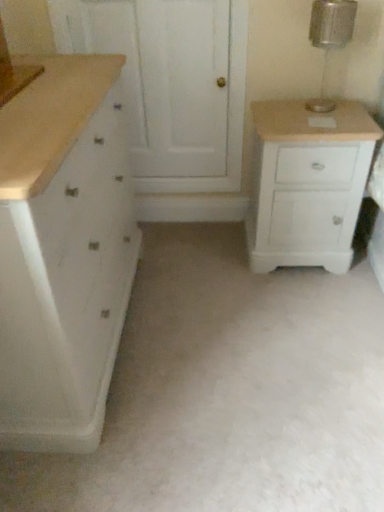
Question: Can you confirm if metallic glass lamp at upper right is positioned to the left of white matte chest of drawers at left, the 2th chest of drawers when ordered from right to left?

Choices:
 (A) no
 (B) yes

Answer: (A)

Question: Are metallic glass lamp at upper right and white matte chest of drawers at left, which is the first chest of drawers from left to right, far apart?

Choices:
 (A) no
 (B) yes

Answer: (B)

Question: From a real-world perspective, is metallic glass lamp at upper right beneath white matte chest of drawers at left, the 2th chest of drawers when ordered from right to left?

Choices:
 (A) yes
 (B) no

Answer: (B)

Question: Is metallic glass lamp at upper right turned away from white matte chest of drawers at left, which is the first chest of drawers from left to right?

Choices:
 (A) no
 (B) yes

Answer: (A)

Question: Can you confirm if metallic glass lamp at upper right is shorter than white matte chest of drawers at left, which is the first chest of drawers from left to right?

Choices:
 (A) no
 (B) yes

Answer: (B)

Question: Is metallic glass lamp at upper right positioned beyond the bounds of white matte chest of drawers at left, the 2th chest of drawers when ordered from right to left?

Choices:
 (A) yes
 (B) no

Answer: (A)

Question: From a real-world perspective, does white matte chest of drawers at left, the 2th chest of drawers when ordered from right to left, sit lower than white painted wood cabinet at right, which is the first chest of drawers in right-to-left order?

Choices:
 (A) yes
 (B) no

Answer: (B)

Question: Considering the relative positions of white matte chest of drawers at left, which is the first chest of drawers from left to right, and white painted wood cabinet at right, which is the first chest of drawers in right-to-left order, in the image provided, is white matte chest of drawers at left, which is the first chest of drawers from left to right, to the right of white painted wood cabinet at right, which is the first chest of drawers in right-to-left order, from the viewer's perspective?

Choices:
 (A) no
 (B) yes

Answer: (A)

Question: Is white matte chest of drawers at left, the 2th chest of drawers when ordered from right to left, completely or partially outside of white painted wood cabinet at right, which is the first chest of drawers in right-to-left order?

Choices:
 (A) no
 (B) yes

Answer: (B)

Question: Is white painted wood cabinet at right, which is the first chest of drawers in right-to-left order, inside white matte chest of drawers at left, which is the first chest of drawers from left to right?

Choices:
 (A) yes
 (B) no

Answer: (B)

Question: Could you tell me if white matte chest of drawers at left, which is the first chest of drawers from left to right, is facing white painted wood cabinet at right, the 2th chest of drawers positioned from the left?

Choices:
 (A) no
 (B) yes

Answer: (B)

Question: Is white matte chest of drawers at left, which is the first chest of drawers from left to right, thinner than white painted wood cabinet at right, the 2th chest of drawers positioned from the left?

Choices:
 (A) no
 (B) yes

Answer: (A)

Question: Is white matte chest of drawers at left, the 2th chest of drawers when ordered from right to left, a part of white wood screen door at upper center?

Choices:
 (A) yes
 (B) no

Answer: (B)